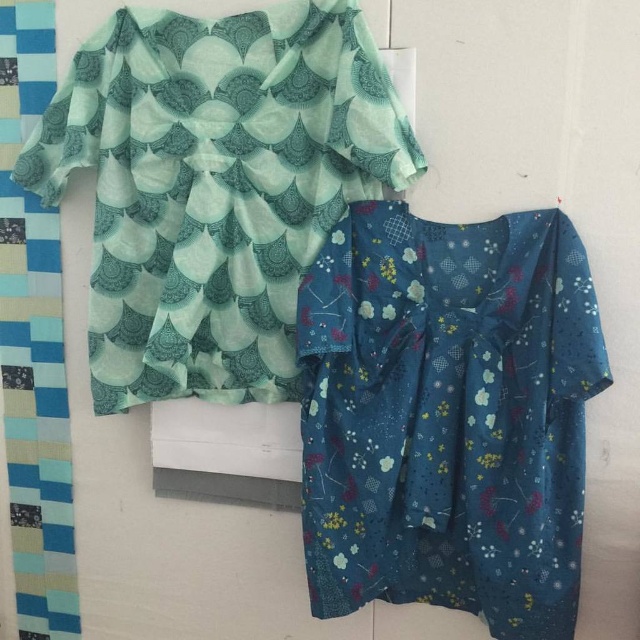
You are a customer in a boutique and see the blue floral fabric dress at lower right and the teal fabric dress at upper left. Which dress is located to the right of the other?

The blue floral fabric dress at lower right is positioned on the right side of the teal fabric dress at upper left.

You are standing in front of two fabrics hanging on a wall. You see a point labeled as point (448, 416). Which fabric is this point located on?

The point (448, 416) is located on the blue floral fabric dress at lower right.